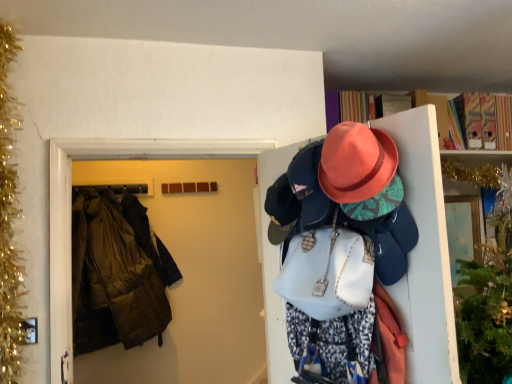
Describe the element at coordinates (9, 219) in the screenshot. The image size is (512, 384). I see `gold tinsel garland at left` at that location.

What do you see at coordinates (71, 208) in the screenshot? This screenshot has height=384, width=512. I see `brown fabric coat at left` at bounding box center [71, 208].

This screenshot has width=512, height=384. What do you see at coordinates (117, 273) in the screenshot? I see `dark brown leather jacket at left` at bounding box center [117, 273].

In order to click on dark brown leather jacket at left in this screenshot , I will do `click(117, 273)`.

Measure the distance between matte pink hat at upper right and camera.

The distance of matte pink hat at upper right from camera is 2.51 meters.

I want to click on gold tinsel garland at left, so click(9, 219).

Are dark brown leather jacket at left and matte pink hat at upper right making contact?

No, dark brown leather jacket at left is not in contact with matte pink hat at upper right.

Considering the relative sizes of dark brown leather jacket at left and matte pink hat at upper right in the image provided, is dark brown leather jacket at left shorter than matte pink hat at upper right?

Correct, dark brown leather jacket at left is not as tall as matte pink hat at upper right.

Identify the location of bookcase directly beneath the dark brown leather jacket at left (from a real-world perspective). (471, 172).

Is dark brown leather jacket at left bigger or smaller than matte pink hat at upper right?

In the image, dark brown leather jacket at left appears to be smaller than matte pink hat at upper right.

From the image's perspective, which object appears higher, dark brown leather jacket at left or gold tinsel garland at left?

From the image's view, gold tinsel garland at left is above.

Is dark brown leather jacket at left smaller than gold tinsel garland at left?

No, dark brown leather jacket at left is not smaller than gold tinsel garland at left.

Between dark brown leather jacket at left and gold tinsel garland at left, which one has larger width?

With larger width is dark brown leather jacket at left.

How many degrees apart are the facing directions of dark brown leather jacket at left and gold tinsel garland at left?

They differ by 90.5 degrees in their facing directions.

Which of these two, gold tinsel garland at left or brown fabric coat at left, is bigger?

With larger size is brown fabric coat at left.

Is point (6, 76) behind point (222, 150)?

No, (6, 76) is closer to viewer.

How distant is gold tinsel garland at left from brown fabric coat at left?

The distance of gold tinsel garland at left from brown fabric coat at left is 10.95 inches.

At what (x,y) coordinates should I click in order to perform the action: click on christmas decoration above the brown fabric coat at left (from the image's perspective). Please return your answer as a coordinate pair (x, y). Image resolution: width=512 pixels, height=384 pixels. Looking at the image, I should click on (9, 219).

Is dark brown leather jacket at left taller than brown fabric coat at left?

Yes, dark brown leather jacket at left is taller than brown fabric coat at left.

Is dark brown leather jacket at left bigger than brown fabric coat at left?

Yes.

Does dark brown leather jacket at left turn towards brown fabric coat at left?

Yes.

Considering their positions, is dark brown leather jacket at left located in front of or behind brown fabric coat at left?

Visually, dark brown leather jacket at left is located behind brown fabric coat at left.

The height and width of the screenshot is (384, 512). I want to click on jacket to the left of gold tinsel garland at left, so click(x=117, y=273).

From the image's perspective, is gold tinsel garland at left located beneath dark brown leather jacket at left?

No.

Considering the relative positions of gold tinsel garland at left and dark brown leather jacket at left in the image provided, is gold tinsel garland at left to the right of dark brown leather jacket at left from the viewer's perspective?

Yes.

Is point (52, 188) positioned after point (2, 95)?

Yes, it is behind point (2, 95).

Is brown fabric coat at left inside the boundaries of gold tinsel garland at left, or outside?

brown fabric coat at left lies outside gold tinsel garland at left.

From a real-world perspective, which object rests below the other?

brown fabric coat at left is physically lower.

Does brown fabric coat at left lie behind gold tinsel garland at left?

That is True.

How many degrees apart are the facing directions of gold tinsel garland at left and matte pink hat at upper right?

There is a 92.9-degree angle between the facing directions of gold tinsel garland at left and matte pink hat at upper right.

From the image's perspective, which one is positioned higher, gold tinsel garland at left or matte pink hat at upper right?

From the image's view, gold tinsel garland at left is above.

Is gold tinsel garland at left aimed at matte pink hat at upper right?

Yes, gold tinsel garland at left is aimed at matte pink hat at upper right.

Considering the sizes of gold tinsel garland at left and matte pink hat at upper right in the image, is gold tinsel garland at left bigger or smaller than matte pink hat at upper right?

Clearly, gold tinsel garland at left is smaller in size than matte pink hat at upper right.

Locate an element on the screen. The height and width of the screenshot is (384, 512). jacket behind the matte pink hat at upper right is located at coordinates (117, 273).

Where is `jacket below the gold tinsel garland at left (from the image's perspective)`? The width and height of the screenshot is (512, 384). jacket below the gold tinsel garland at left (from the image's perspective) is located at coordinates (117, 273).

Considering their positions, is matte pink hat at upper right positioned further to dark brown leather jacket at left than brown fabric coat at left?

Based on the image, matte pink hat at upper right appears to be further to dark brown leather jacket at left.

In the scene shown: From the image, which object appears to be nearer to matte pink hat at upper right, brown fabric coat at left or dark brown leather jacket at left?

brown fabric coat at left is positioned closer to the anchor matte pink hat at upper right.

Which object lies further to the anchor point matte pink hat at upper right, brown fabric coat at left or gold tinsel garland at left?

gold tinsel garland at left is further to matte pink hat at upper right.

Considering their positions, is dark brown leather jacket at left positioned further to matte pink hat at upper right than gold tinsel garland at left?

The object further to matte pink hat at upper right is gold tinsel garland at left.

From the image, which object appears to be farther from brown fabric coat at left, dark brown leather jacket at left or gold tinsel garland at left?

The object further to brown fabric coat at left is dark brown leather jacket at left.

Considering their positions, is brown fabric coat at left positioned closer to gold tinsel garland at left than dark brown leather jacket at left?

brown fabric coat at left.

Looking at the image, which one is located further to dark brown leather jacket at left, brown fabric coat at left or matte pink hat at upper right?

matte pink hat at upper right is further to dark brown leather jacket at left.

Looking at the image, which one is located further to brown fabric coat at left, gold tinsel garland at left or matte pink hat at upper right?

matte pink hat at upper right is further to brown fabric coat at left.

Where is `christmas decoration located between dark brown leather jacket at left and matte pink hat at upper right in the left-right direction`? christmas decoration located between dark brown leather jacket at left and matte pink hat at upper right in the left-right direction is located at coordinates (9, 219).

Where is `door between gold tinsel garland at left and dark brown leather jacket at left along the z-axis`? The image size is (512, 384). door between gold tinsel garland at left and dark brown leather jacket at left along the z-axis is located at coordinates (71, 208).

The height and width of the screenshot is (384, 512). In order to click on door between dark brown leather jacket at left and matte pink hat at upper right in this screenshot , I will do `click(71, 208)`.

At what (x,y) coordinates should I click in order to perform the action: click on door between gold tinsel garland at left and matte pink hat at upper right in the horizontal direction. Please return your answer as a coordinate pair (x, y). Looking at the image, I should click on (71, 208).